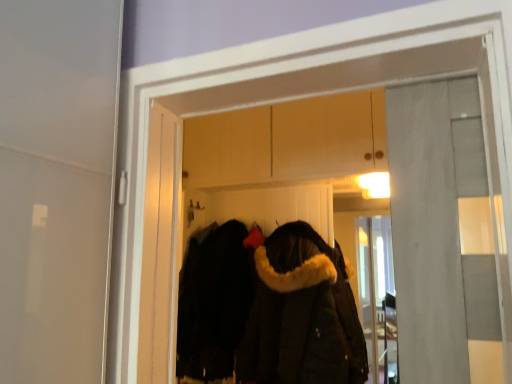
Question: Is point (230, 125) closer or farther from the camera than point (180, 340)?

Choices:
 (A) closer
 (B) farther

Answer: (B)

Question: In the image, is black fur-lined coat at center on the left side or the right side of black fuzzy coat at center, the first cloak from the left?

Choices:
 (A) right
 (B) left

Answer: (A)

Question: Considering the real-world distances, which object is farthest from the black fur-lined coat at center?

Choices:
 (A) black fuzzy coat at center, the 2th cloak in the right-to-left sequence
 (B) dark brown fur-lined coat at center, the 2th cloak from the left

Answer: (B)

Question: Which object is the farthest from the black fuzzy coat at center, the 2th cloak in the right-to-left sequence?

Choices:
 (A) dark brown fur-lined coat at center, the 1th cloak in the right-to-left sequence
 (B) black fur-lined coat at center

Answer: (B)